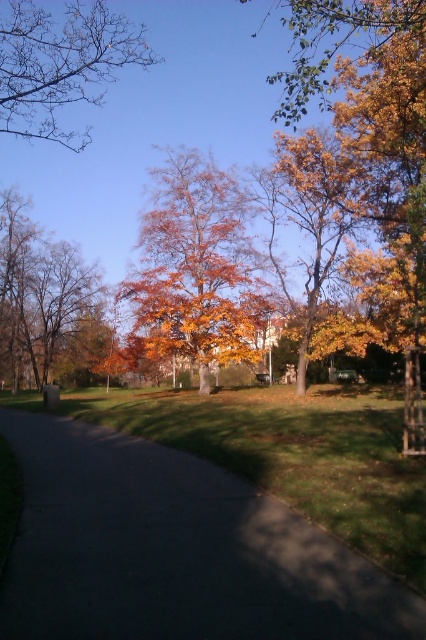
You are a park visitor standing on the paved pathway in the foreground. You want to take a photo of both the orange leafy tree at center and the brown matte tree at left. Which tree should you position closer to the camera to include both in your shot?

To include both the orange leafy tree at center and the brown matte tree at left in your photo, you should position the orange leafy tree at center closer to the camera since it is shorter than the brown matte tree at left. This way, both trees will be visible in the frame.

You are a gardener who needs to walk along the dark asphalt path at center to collect fallen leaves. The path is bordered by grassy areas. If you start at one end of the path and walk to the other end, how far will you have walked?

The dark asphalt path at center is 3.74 meters long, so walking from one end to the other would cover a distance of 3.74 meters.